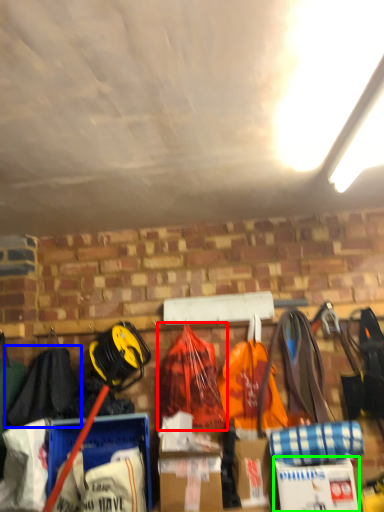
Question: Which is farther away from backpack (highlighted by a red box)? clothing (highlighted by a blue box) or cardboard box (highlighted by a green box)?

Choices:
 (A) clothing
 (B) cardboard box

Answer: (A)